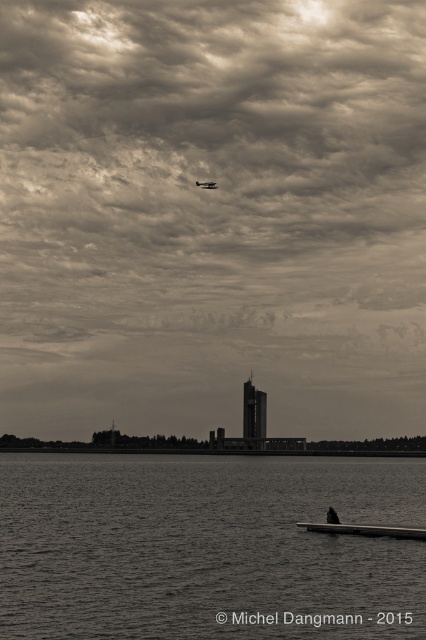
Question: Considering the real-world distances, which object is closest to the smooth wooden boat at lower center?

Choices:
 (A) cloudy sky at upper center
 (B) smooth water at lower left
 (C) metallic silver seaplane at upper center
 (D) smooth concrete horizon at center

Answer: (B)

Question: Which point is farther to the camera?

Choices:
 (A) (276, 237)
 (B) (385, 532)
 (C) (143, 451)

Answer: (A)

Question: Is cloudy sky at upper center further to the viewer compared to smooth concrete horizon at center?

Choices:
 (A) no
 (B) yes

Answer: (B)

Question: Is cloudy sky at upper center closer to camera compared to smooth water at lower left?

Choices:
 (A) no
 (B) yes

Answer: (A)

Question: Which point is farther from the camera taking this photo?

Choices:
 (A) (186, 492)
 (B) (77, 449)
 (C) (195, 180)
 (D) (54, 401)

Answer: (D)

Question: Where is smooth concrete horizon at center located in relation to metallic silver seaplane at upper center in the image?

Choices:
 (A) below
 (B) above

Answer: (A)